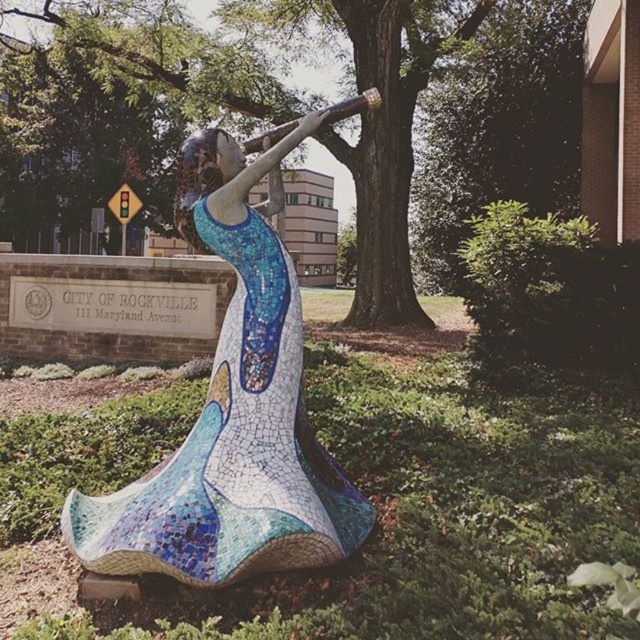
Is mosaic tile woman at center thinner than green leafy tree at center?

Yes.

Is point (260, 524) positioned after point (532, 131)?

No, (260, 524) is in front of (532, 131).

Where is `mosaic tile woman at center`? mosaic tile woman at center is located at coordinates (234, 410).